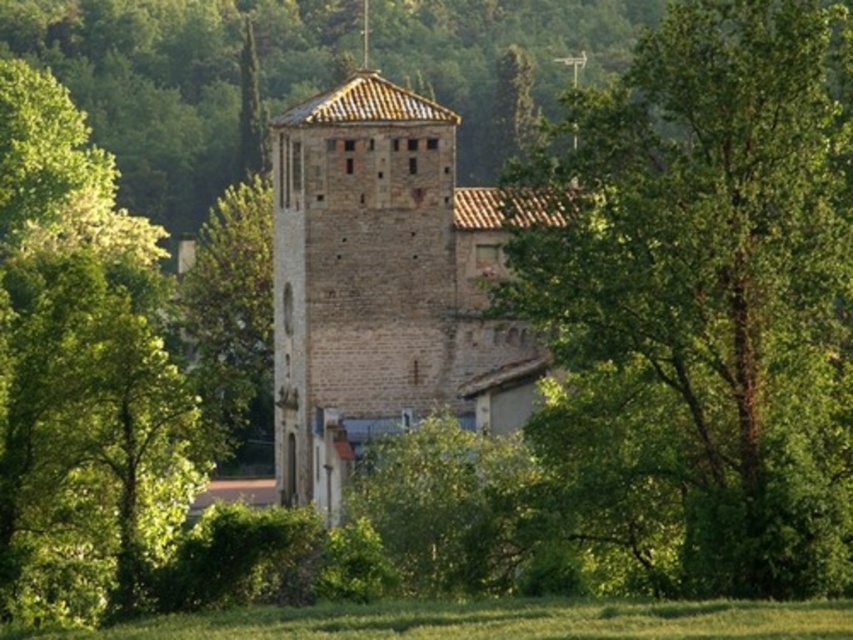
You are a photographer planning to take a picture of the brown stone tower at center. You notice a green leafy tree at center in the foreground. Will the tree block the view of the tower in your photo?

The green leafy tree at center is taller than the brown stone tower at center, so the tree may block the view of the tower depending on the camera angle and distance. To ensure the tower is visible, position yourself further back or adjust the angle to frame around the tree.

You are a hiker who wants to take a photo of the brown stone tower at center from the green leafy tree at center. Considering the distance between them, do you think you can clearly capture the tower in your photo without moving closer?

The distance between the green leafy tree at center and the brown stone tower at center is 31.63 feet. Since this distance is manageable for a standard camera lens, you can clearly capture the tower without needing to move closer.

Consider the image. You are a photographer aiming to capture a clear view of the brown stone tower at center without any obstruction from the green leafy tree at center. Based on their positions, which direction should you move to ensure the tree is no longer blocking the tower?

The green leafy tree at center is positioned on the right side of the brown stone tower at center. To avoid the tree blocking the tower, move to the right side of the tower so the tree is out of the frame.